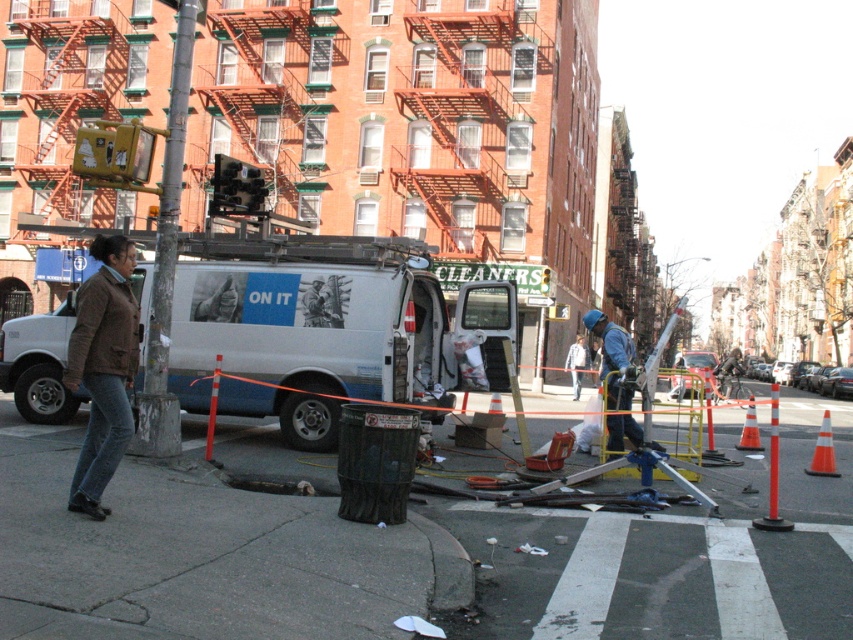
Question: Does concrete sidewalk at lower left have a greater width compared to blue hard hat at center?

Choices:
 (A) no
 (B) yes

Answer: (B)

Question: Where is white matte van at center located in relation to blue hard hat at center in the image?

Choices:
 (A) below
 (B) above

Answer: (B)

Question: Does concrete sidewalk at lower left appear on the left side of brown woolen jacket at lower left?

Choices:
 (A) yes
 (B) no

Answer: (B)

Question: Which object is closer to the camera taking this photo?

Choices:
 (A) concrete sidewalk at lower left
 (B) white matte van at center
 (C) blue hard hat at center

Answer: (A)

Question: Which point is closer to the camera?

Choices:
 (A) (80, 531)
 (B) (390, 388)
 (C) (631, 388)

Answer: (A)

Question: Which of the following is the farthest from the observer?

Choices:
 (A) (96, 388)
 (B) (320, 291)
 (C) (315, 589)
 (D) (631, 362)

Answer: (B)